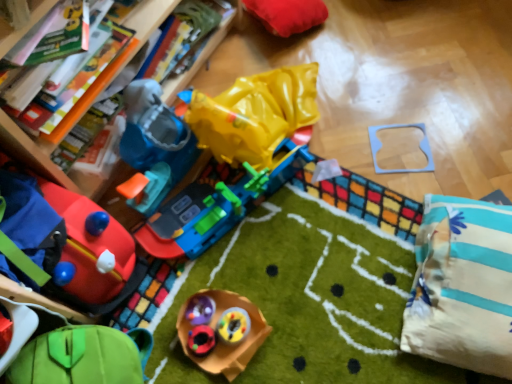
Identify the location of space that is in front of rubberized plastic toy at center, the 5th toy when ordered from top to bottom. (237, 360).